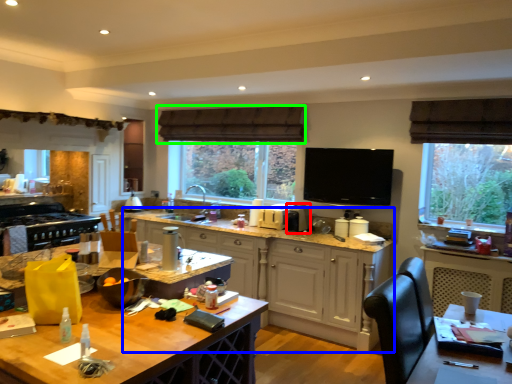
Question: Which is nearer to the appliance (highlighted by a red box)? cabinetry (highlighted by a blue box) or exhaust hood (highlighted by a green box).

Choices:
 (A) cabinetry
 (B) exhaust hood

Answer: (A)